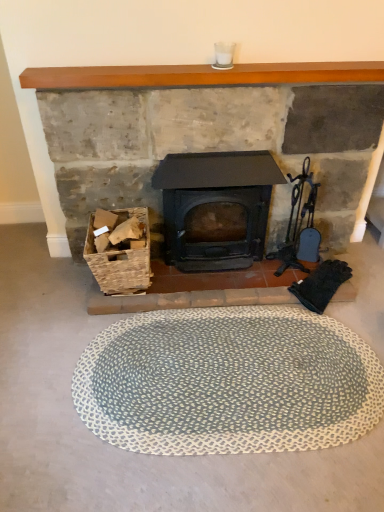
You are a GUI agent. You are given a task and a screenshot of the screen. Output one action in this format:
    pyautogui.click(x=<x>, y=<y>)
    Task: Click on the blank space situated above wooden mantlepiece at upper center (from a real-world perspective)
    Image resolution: width=384 pixels, height=512 pixels.
    Given the screenshot: What is the action you would take?
    pyautogui.click(x=210, y=68)